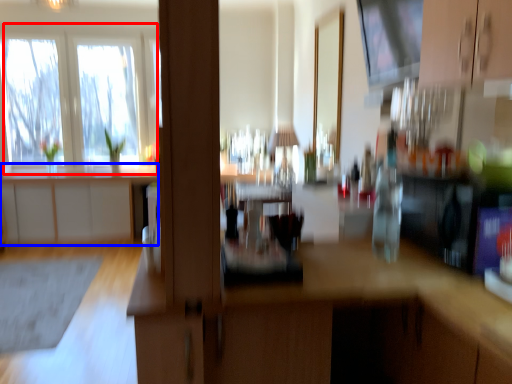
Question: Which object appears closest to the camera in this image, window (highlighted by a red box) or cabinetry (highlighted by a blue box)?

Choices:
 (A) window
 (B) cabinetry

Answer: (B)